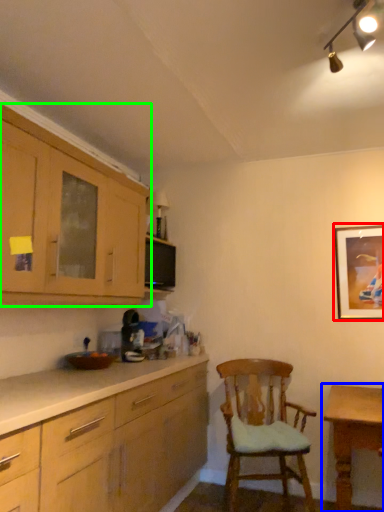
Question: Considering the real-world distances, which object is farthest from picture frame (highlighted by a red box)? table (highlighted by a blue box) or cabinetry (highlighted by a green box)?

Choices:
 (A) table
 (B) cabinetry

Answer: (B)